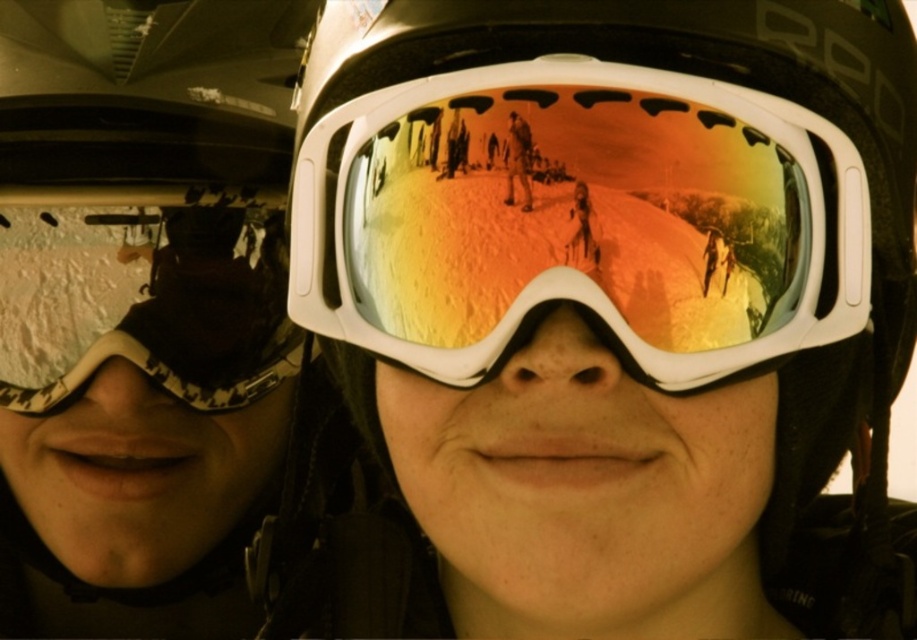
Does point (659, 243) come farther from viewer compared to point (226, 224)?

No, it is not.

Is point (668, 378) positioned before point (138, 326)?

Yes.

Between point (664, 150) and point (234, 227), which one is positioned behind?

Point (234, 227)

Image resolution: width=917 pixels, height=640 pixels. Identify the location of white reflective lens at center. (578, 220).